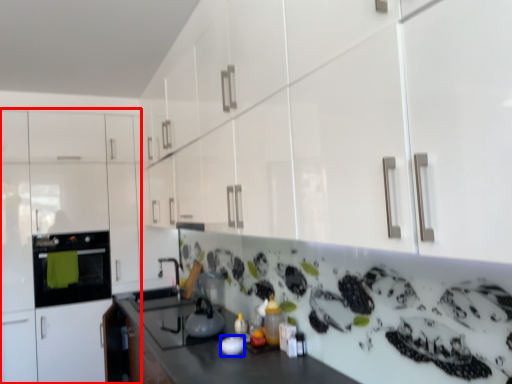
Question: Which object appears closest to the camera in this image, cabinetry (highlighted by a red box) or appliance (highlighted by a blue box)?

Choices:
 (A) cabinetry
 (B) appliance

Answer: (B)